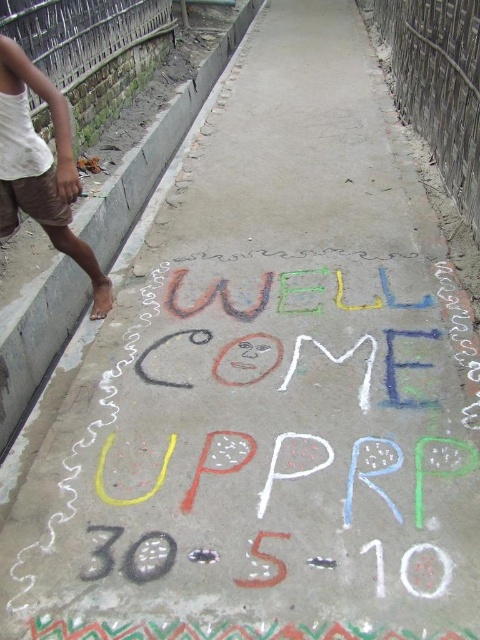
Question: Which point appears closest to the camera in this image?

Choices:
 (A) (9, 93)
 (B) (43, 353)

Answer: (A)

Question: Considering the relative positions of gray concrete curb at lower left and brown cotton shorts at left in the image provided, where is gray concrete curb at lower left located with respect to brown cotton shorts at left?

Choices:
 (A) left
 (B) right

Answer: (B)

Question: Is gray concrete curb at lower left smaller than brown cotton shorts at left?

Choices:
 (A) yes
 (B) no

Answer: (B)

Question: Observing the image, what is the correct spatial positioning of gray concrete curb at lower left in reference to brown cotton shorts at left?

Choices:
 (A) above
 (B) below

Answer: (A)

Question: Among these points, which one is farthest from the camera?

Choices:
 (A) (58, 292)
 (B) (62, 163)

Answer: (A)